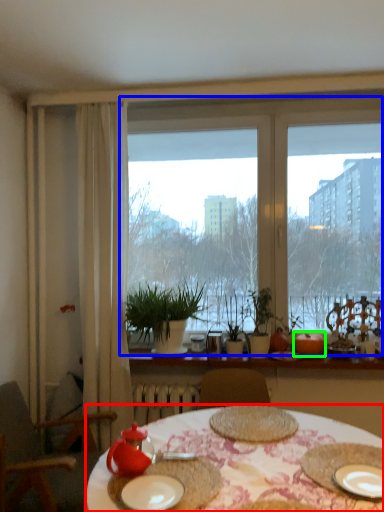
Question: Which object is positioned closest to desk (highlighted by a red box)? Select from window (highlighted by a blue box) and fruit (highlighted by a green box).

Choices:
 (A) window
 (B) fruit

Answer: (B)